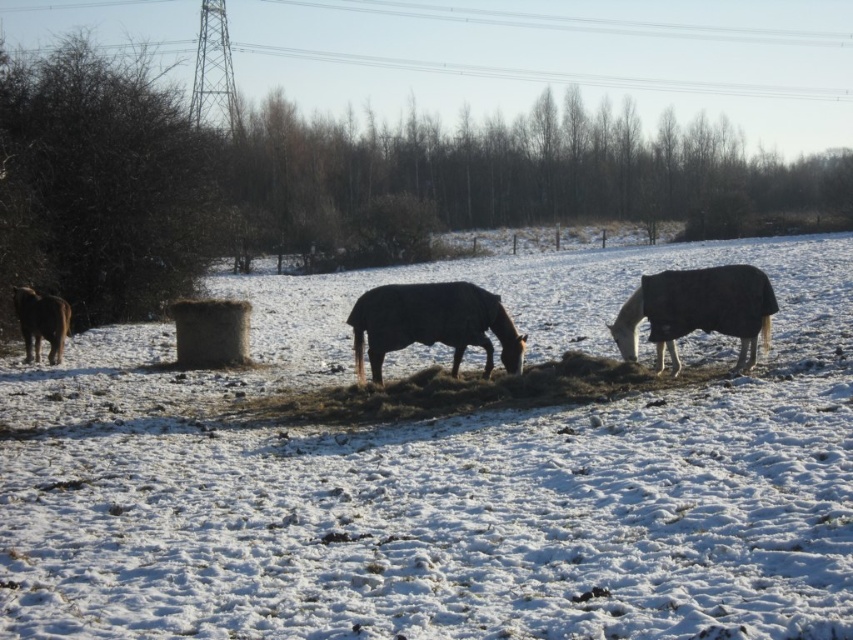
You are a farmer checking on your horses in the snowy field. You see the brown matte horse at center and the brown furry horse at left. Which horse is positioned to the right side of the other?

The brown matte horse at center is positioned to the right of the brown furry horse at left.